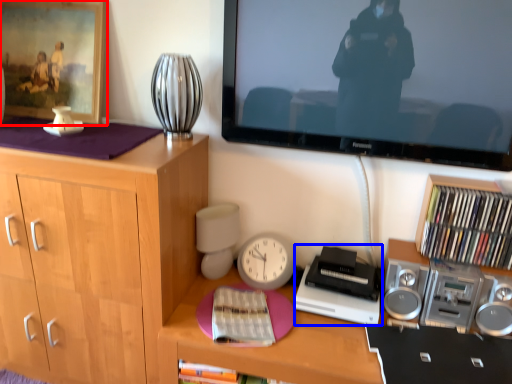
Question: Which of the following is the closest to the observer, picture frame (highlighted by a red box) or equipment (highlighted by a blue box)?

Choices:
 (A) picture frame
 (B) equipment

Answer: (B)